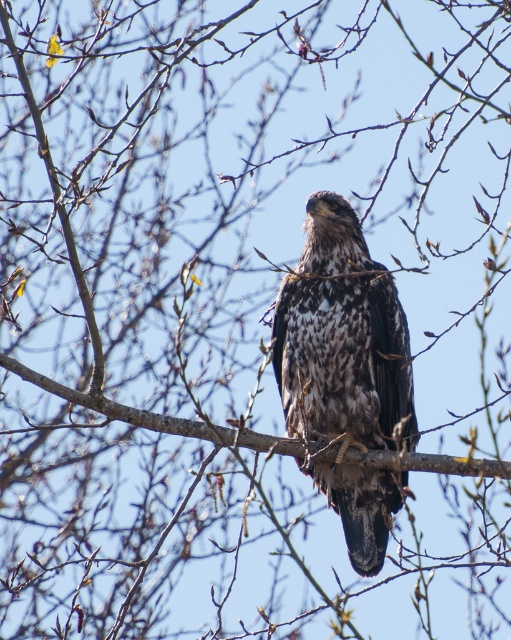
You are an ornithologist observing the speckled feathers falcon at center and the brown textured branch at center. Which object is closer to you?

The speckled feathers falcon at center is closer to you than the brown textured branch at center.

You are standing in a forest clearing and see a point marked at coordinates (385, 372). If you want to place a bird feeder 3 meters away from this point, which direction should you move relative to the point to ensure it stays within the clearing?

To place the bird feeder 3 meters away from the point while staying within the clearing, move towards the camera since the point is 6.87 meters away from the camera, allowing space for the feeder closer to the camera.

You are an ornithologist observing a bird in its natural habitat. You notice the speckled feathers falcon at center and the brown textured branch at center. Which object takes up more area in the image?

The brown textured branch at center takes up more area than the speckled feathers falcon at center because the falcon occupies less space than the branch.